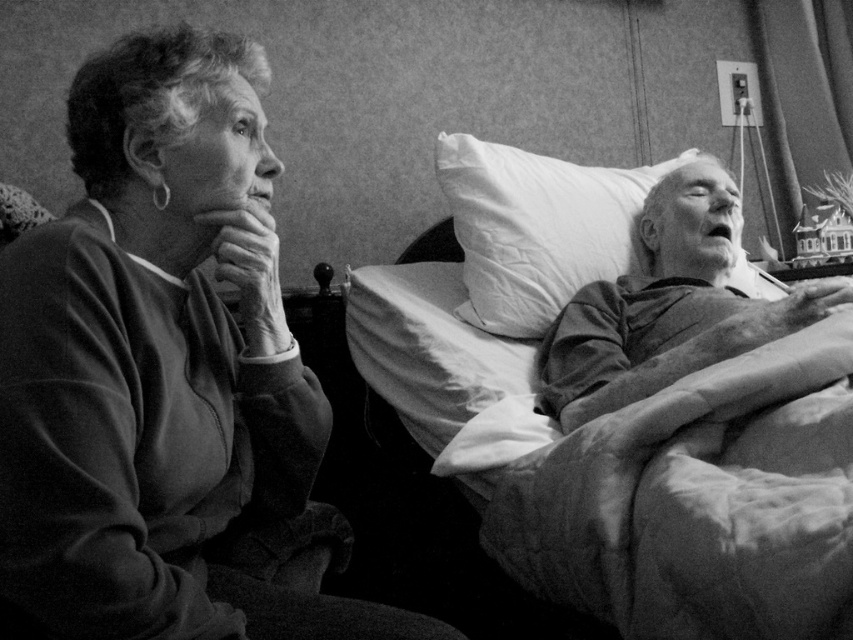
Based on the scene described, which object is positioned higher in the frame, the sweatshirt at left or the fluffy white pillow at right?

The sweatshirt at left is positioned higher in the frame than the fluffy white pillow at right according to the description.

You are a photographer standing 30 inches away from the sweatshirt at left. Can you reach it without moving your feet?

The sweatshirt at left is 25.21 inches away from the viewer. Since you are standing 30 inches away, you cannot reach it without moving your feet because it is farther than your current position.

In the black and white photo, there are two people. The woman on the left is sitting with her hand under her chin, and the man on the right is lying in bed. The coordinates point to a specific feature. What does the point at (668,305) indicate about the man at the right?

The point at (668,305) corresponds to the smooth skin of the man at the right, indicating that area has a softer texture compared to other parts of the image.